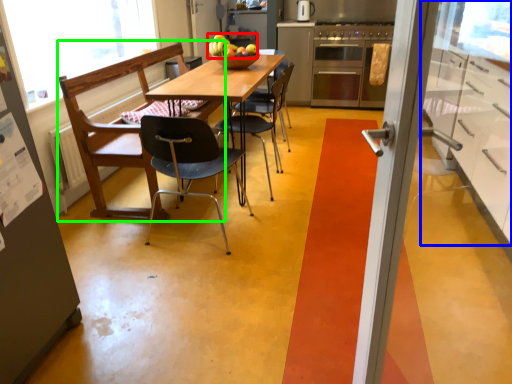
Question: Considering the real-world distances, which object is closest to fruit (highlighted by a red box)? cabinetry (highlighted by a blue box) or chair (highlighted by a green box).

Choices:
 (A) cabinetry
 (B) chair

Answer: (B)